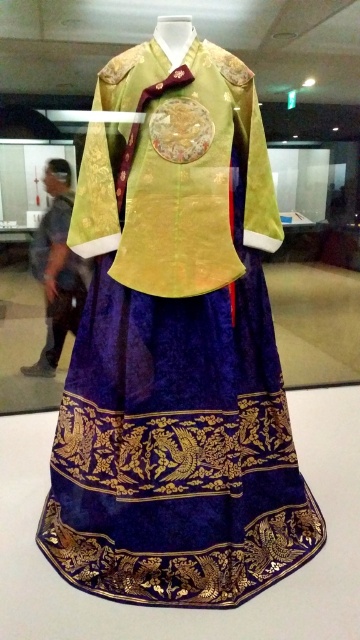
Question: Is the position of velvet gold brocade dress at center more distant than that of velvet fabric dress at center?

Choices:
 (A) no
 (B) yes

Answer: (A)

Question: Which point is farther to the camera?

Choices:
 (A) velvet fabric dress at center
 (B) velvet gold brocade dress at center

Answer: (A)

Question: Does velvet gold brocade dress at center appear on the left side of velvet fabric dress at center?

Choices:
 (A) yes
 (B) no

Answer: (B)

Question: Is velvet gold brocade dress at center to the left of velvet fabric dress at center from the viewer's perspective?

Choices:
 (A) no
 (B) yes

Answer: (A)